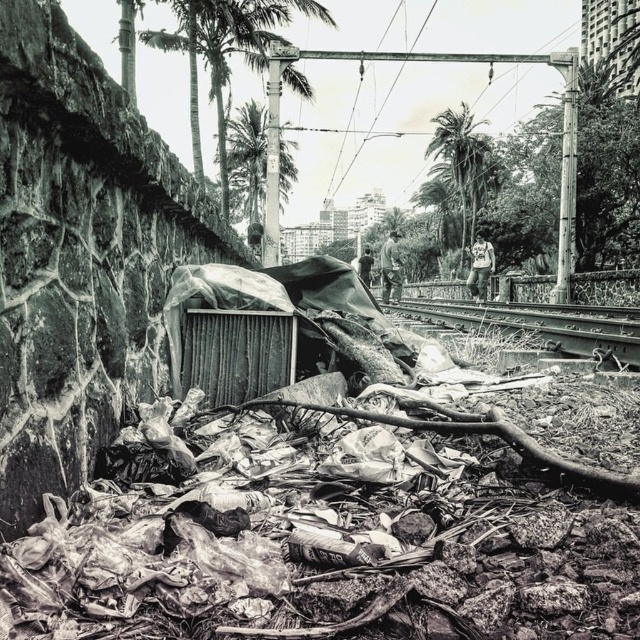
You are standing at the point marked as point [544,324] in the image. What object is directly beneath your feet?

The smooth metal train track at center is directly beneath your feet at point [544,324].

You are a photographer adjusting your camera settings to focus on two points in the image. The first point is at coordinate point (198, 29) and the second is at coordinate point (481, 189). Which point should you focus on first if you want to ensure both points are in focus without moving the camera?

You should focus on point (198, 29) first because it is closer to the camera than point (481, 189). By focusing on the closer point, the farther point will also be within the depth of field, ensuring both are in focus without moving the camera.

You are a photographer standing at the base of the stone wall in the urban scene. You want to capture a photo that includes both the thick textured palm tree at upper center and the green leafy palm tree at upper right. Given their distance apart, will you need to adjust your camera to a wider angle to fit both into the frame?

The thick textured palm tree at upper center and green leafy palm tree at upper right are 20.70 meters apart from each other. To capture both in the same frame, you would need to use a wider angle lens to accommodate the distance between them.